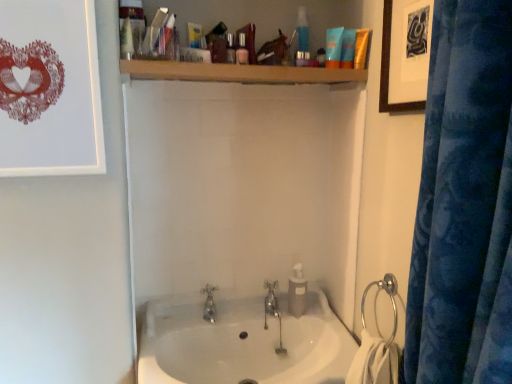
Describe the element at coordinates (297, 292) in the screenshot. The height and width of the screenshot is (384, 512). I see `white plastic soap dispenser at center, the 5th toiletry positioned from the front` at that location.

The image size is (512, 384). I want to click on silver metallic towel ring at right, so click(x=376, y=301).

In order to face silver metallic tap at center, the second tap from the left, should I rotate leftwards or rightwards?

To align with it, rotate right about 1.985°.

What is the approximate height of wooden shelf at upper center?

9.59 inches.

How much space does white paper with red lace heart at upper left, marked as the 1th picture frame in a left-to-right arrangement, occupy horizontally?

white paper with red lace heart at upper left, marked as the 1th picture frame in a left-to-right arrangement, is 1.13 inches wide.

This screenshot has width=512, height=384. What are the coordinates of `white plastic soap dispenser at center, positioned as the second toiletry in left-to-right order` in the screenshot? It's located at (297, 292).

Does matte blue tube at upper center, which appears as the 5th toiletry when ordered from the bottom, appear on the right side of white paper with red lace heart at upper left, marked as the 1th picture frame in a left-to-right arrangement?

Correct, you'll find matte blue tube at upper center, which appears as the 5th toiletry when ordered from the bottom, to the right of white paper with red lace heart at upper left, marked as the 1th picture frame in a left-to-right arrangement.

Considering the relative sizes of matte blue tube at upper center, which appears as the 5th toiletry when ordered from the bottom, and white paper with red lace heart at upper left, marked as the 1th picture frame in a left-to-right arrangement, in the image provided, is matte blue tube at upper center, which appears as the 5th toiletry when ordered from the bottom, smaller than white paper with red lace heart at upper left, marked as the 1th picture frame in a left-to-right arrangement,?

Correct, matte blue tube at upper center, which appears as the 5th toiletry when ordered from the bottom, occupies less space than white paper with red lace heart at upper left, marked as the 1th picture frame in a left-to-right arrangement.

Is point (343, 38) closer or farther from the camera than point (92, 34)?

Point (343, 38) is positioned farther from the camera compared to point (92, 34).

The height and width of the screenshot is (384, 512). I want to click on the 2nd toiletry above the silver metallic towel ring at right (from a real-world perspective), so click(x=361, y=48).

Is gold metallic lotion at upper right, which is counted as the fifth toiletry, starting from the left, to the left of silver metallic towel ring at right from the viewer's perspective?

Indeed, gold metallic lotion at upper right, which is counted as the fifth toiletry, starting from the left, is positioned on the left side of silver metallic towel ring at right.

Is gold metallic lotion at upper right, positioned as the 1th toiletry in right-to-left order, thinner than silver metallic towel ring at right?

Indeed, gold metallic lotion at upper right, positioned as the 1th toiletry in right-to-left order, has a lesser width compared to silver metallic towel ring at right.

Which is more distant, (x=355, y=57) or (x=384, y=276)?

The point (x=355, y=57) is farther from the camera.

Is silver metallic tap at center, which is the 1th tap from right to left, oriented away from silver metallic towel ring at right?

silver metallic tap at center, which is the 1th tap from right to left, does not have its back to silver metallic towel ring at right.

Based on the photo, does silver metallic tap at center, which is the 1th tap from right to left, come behind silver metallic towel ring at right?

Yes.

Is silver metallic tap at center, the second tap from the left, surrounding silver metallic towel ring at right?

That's incorrect, silver metallic towel ring at right is not inside silver metallic tap at center, the second tap from the left.

In terms of height, does white plastic soap dispenser at center, the 1th toiletry viewed from the back, look taller or shorter compared to wooden framed artwork at upper right, placed as the first picture frame when sorted from right to left?

Considering their sizes, white plastic soap dispenser at center, the 1th toiletry viewed from the back, has less height than wooden framed artwork at upper right, placed as the first picture frame when sorted from right to left.

Based on the photo, is white plastic soap dispenser at center, which is the 5th toiletry in top-to-bottom order, far from wooden framed artwork at upper right, placed as the first picture frame when sorted from right to left?

No.

Based on the photo, considering the relative positions of white plastic soap dispenser at center, which is the first toiletry in bottom-to-top order, and wooden framed artwork at upper right, placed as the first picture frame when sorted from right to left, in the image provided, is white plastic soap dispenser at center, which is the first toiletry in bottom-to-top order, behind wooden framed artwork at upper right, placed as the first picture frame when sorted from right to left,?

Yes, the depth of white plastic soap dispenser at center, which is the first toiletry in bottom-to-top order, is greater than that of wooden framed artwork at upper right, placed as the first picture frame when sorted from right to left.

From a real-world perspective, between white plastic soap dispenser at center, positioned as the second toiletry in left-to-right order, and wooden framed artwork at upper right, placed as the first picture frame when sorted from right to left, who is vertically lower?

In real-world perspective, white plastic soap dispenser at center, positioned as the second toiletry in left-to-right order, is lower.

Considering the sizes of objects white plastic soap dispenser at center, the fourth toiletry when ordered from right to left, and blue matte lotion at upper center, which is counted as the 3th toiletry, starting from the left, in the image provided, who is wider, white plastic soap dispenser at center, the fourth toiletry when ordered from right to left, or blue matte lotion at upper center, which is counted as the 3th toiletry, starting from the left,?

Wider between the two is white plastic soap dispenser at center, the fourth toiletry when ordered from right to left.

Which is more to the right, white plastic soap dispenser at center, which is the first toiletry in bottom-to-top order, or blue matte lotion at upper center, the 3th toiletry positioned from the back?

From the viewer's perspective, blue matte lotion at upper center, the 3th toiletry positioned from the back, appears more on the right side.

Who is shorter, white plastic soap dispenser at center, which is the first toiletry in bottom-to-top order, or blue matte lotion at upper center, arranged as the second toiletry when viewed from the top?

blue matte lotion at upper center, arranged as the second toiletry when viewed from the top, is shorter.

From a real-world perspective, relative to blue matte lotion at upper center, the 3th toiletry in the right-to-left sequence, is white plastic soap dispenser at center, the fourth toiletry when ordered from right to left, vertically above or below?

white plastic soap dispenser at center, the fourth toiletry when ordered from right to left, is below blue matte lotion at upper center, the 3th toiletry in the right-to-left sequence.

Find the location of a particular element. This screenshot has height=384, width=512. the 3rd toiletry in front of the silver metallic tap at center, the second tap from the left is located at coordinates [x=334, y=47].

Which object is positioned more to the right, blue matte lotion at upper center, the 3th toiletry positioned from the back, or silver metallic tap at center, the second tap from the left?

blue matte lotion at upper center, the 3th toiletry positioned from the back, is more to the right.

Is blue matte lotion at upper center, positioned as the 4th toiletry in bottom-to-top order, bigger than silver metallic tap at center, which is the 1th tap from right to left?

Indeed, blue matte lotion at upper center, positioned as the 4th toiletry in bottom-to-top order, has a larger size compared to silver metallic tap at center, which is the 1th tap from right to left.

In terms of height, does matte blue tube at upper center, which appears as the 5th toiletry when ordered from the bottom, look taller or shorter compared to white glossy sink at center?

matte blue tube at upper center, which appears as the 5th toiletry when ordered from the bottom, is shorter than white glossy sink at center.

Considering the relative positions of matte blue tube at upper center, marked as the 1th toiletry in a top-to-bottom arrangement, and white glossy sink at center in the image provided, is matte blue tube at upper center, marked as the 1th toiletry in a top-to-bottom arrangement, in front of white glossy sink at center?

That is False.

From the image's perspective, starting from the white glossy sink at center, which toiletry is the 5th one above? Please provide its 2D coordinates.

[(348, 49)]

Where is `the 4th toiletry positioned above the white paper with red lace heart at upper left, marked as the 1th picture frame in a left-to-right arrangement (from a real-world perspective)`? The image size is (512, 384). the 4th toiletry positioned above the white paper with red lace heart at upper left, marked as the 1th picture frame in a left-to-right arrangement (from a real-world perspective) is located at coordinates (348, 49).

The height and width of the screenshot is (384, 512). Identify the location of shower that is on the right side of gold metallic lotion at upper right, the 3th toiletry ordered from the bottom. (376, 301).

Estimate the real-world distances between objects in this image. Which object is closer to silver metallic tap at center, which is the 1th tap from right to left, white paper with red lace heart at upper left, marked as the 1th picture frame in a left-to-right arrangement, or silver metallic faucet at center, marked as the first tap in a left-to-right arrangement?

silver metallic faucet at center, marked as the first tap in a left-to-right arrangement, is positioned closer to the anchor silver metallic tap at center, which is the 1th tap from right to left.

Estimate the real-world distances between objects in this image. Which object is closer to silver metallic tap at center, the second tap from the left, white paper with red lace heart at upper left, marked as the 1th picture frame in a left-to-right arrangement, or blue matte lotion at upper center, the 3th toiletry in the right-to-left sequence?

blue matte lotion at upper center, the 3th toiletry in the right-to-left sequence.

Which object lies nearer to the anchor point gold metallic lotion at upper right, which is counted as the fifth toiletry, starting from the left, blue matte lotion at upper center, arranged as the second toiletry when viewed from the top, or silver metallic tap at center, the second tap from the left?

blue matte lotion at upper center, arranged as the second toiletry when viewed from the top, is closer to gold metallic lotion at upper right, which is counted as the fifth toiletry, starting from the left.

Looking at the image, which one is located closer to blue matte lotion at upper center, the 3th toiletry in the right-to-left sequence, translucent plastic container at upper center, which appears as the second toiletry when viewed from the front, or silver metallic towel ring at right?

translucent plastic container at upper center, which appears as the second toiletry when viewed from the front, is closer to blue matte lotion at upper center, the 3th toiletry in the right-to-left sequence.

Based on their spatial positions, is silver metallic towel ring at right or white paper with red lace heart at upper left, which ranks as the 2th picture frame in right-to-left order, further from silver metallic tap at center, the second tap from the left?

white paper with red lace heart at upper left, which ranks as the 2th picture frame in right-to-left order, is further to silver metallic tap at center, the second tap from the left.

Which object lies nearer to the anchor point translucent plastic container at upper center, which appears as the second toiletry when viewed from the front, silver metallic tap at center, which is the 1th tap from right to left, or silver metallic faucet at center, marked as the first tap in a left-to-right arrangement?

silver metallic tap at center, which is the 1th tap from right to left, is positioned closer to the anchor translucent plastic container at upper center, which appears as the second toiletry when viewed from the front.

Based on their spatial positions, is white plastic soap dispenser at center, the fourth toiletry when ordered from right to left, or wooden framed artwork at upper right, acting as the second picture frame starting from the left, further from matte blue tube at upper center, the 2th toiletry when ordered from back to front?

white plastic soap dispenser at center, the fourth toiletry when ordered from right to left, is positioned further to the anchor matte blue tube at upper center, the 2th toiletry when ordered from back to front.

Looking at the image, which one is located further to blue matte lotion at upper center, the 3th toiletry in the right-to-left sequence, silver metallic faucet at center, which is the second tap from right to left, or gold metallic lotion at upper right, which is counted as the fifth toiletry, starting from the left?

The object further to blue matte lotion at upper center, the 3th toiletry in the right-to-left sequence, is silver metallic faucet at center, which is the second tap from right to left.

I want to click on sink between white paper with red lace heart at upper left, marked as the 1th picture frame in a left-to-right arrangement, and silver metallic towel ring at right, in the horizontal direction, so click(x=243, y=341).

Locate an element on the screen. The height and width of the screenshot is (384, 512). bathroom cabinet between white paper with red lace heart at upper left, marked as the 1th picture frame in a left-to-right arrangement, and silver metallic towel ring at right, in the horizontal direction is located at coordinates (264, 15).

At what (x,y) coordinates should I click in order to perform the action: click on bathroom cabinet between translucent plastic container at upper center, the 1th toiletry from the left, and matte blue tube at upper center, the 2th toiletry when ordered from back to front. Please return your answer as a coordinate pair (x, y). Looking at the image, I should click on (264, 15).

The width and height of the screenshot is (512, 384). In order to click on toiletry between wooden framed artwork at upper right, acting as the second picture frame starting from the left, and white glossy sink at center vertically in this screenshot , I will do `click(297, 292)`.